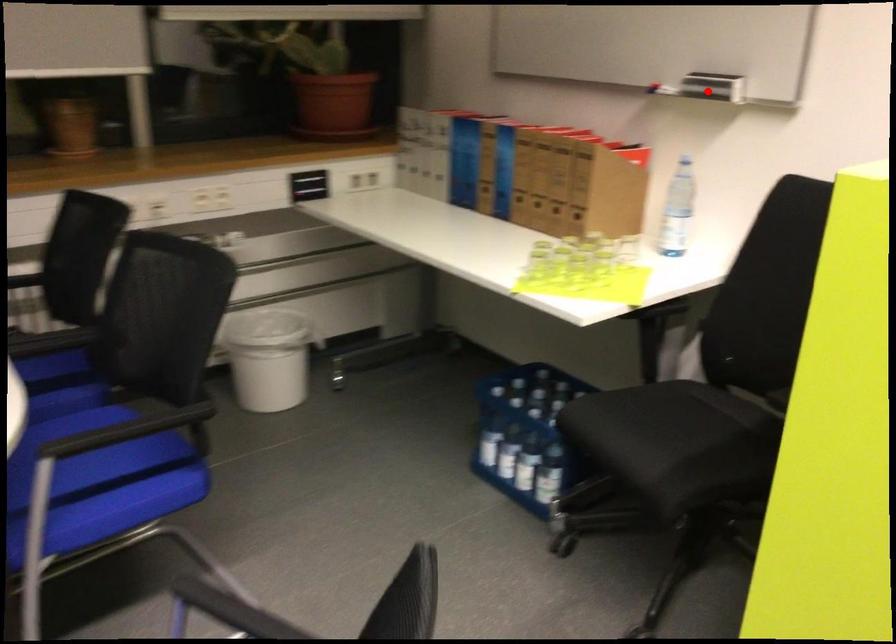
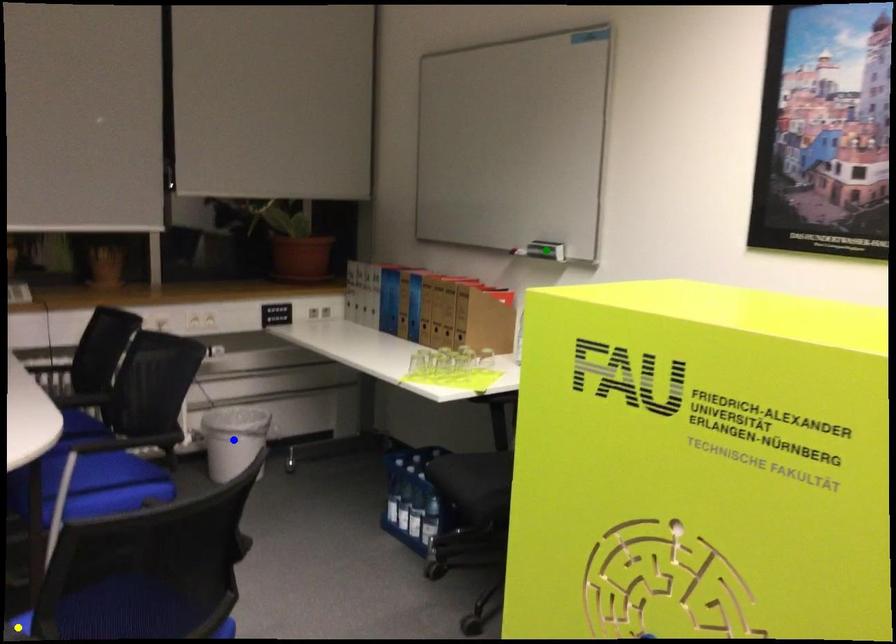
Question: I am providing you with two images of the same scene from different viewpoints. A red point is marked on the first image. You are given multiple points on the second image. Which spot in image 2 lines up with the point in image 1?

Choices:
 (A) green point
 (B) yellow point
 (C) blue point

Answer: (A)